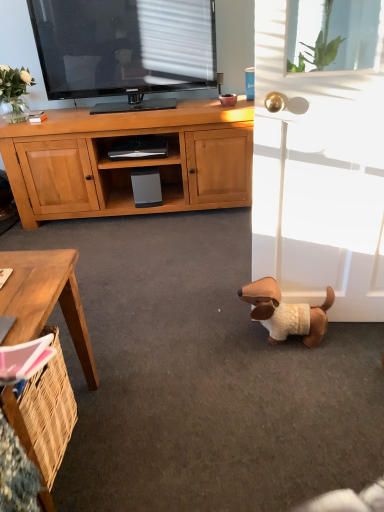
You are a GUI agent. You are given a task and a screenshot of the screen. Output one action in this format:
    pyautogui.click(x=<x>, y=<y>)
    Task: Click on the vacant space situated on the left part of brown plush dog at lower right
    The image size is (384, 512).
    Given the screenshot: What is the action you would take?
    pyautogui.click(x=228, y=343)